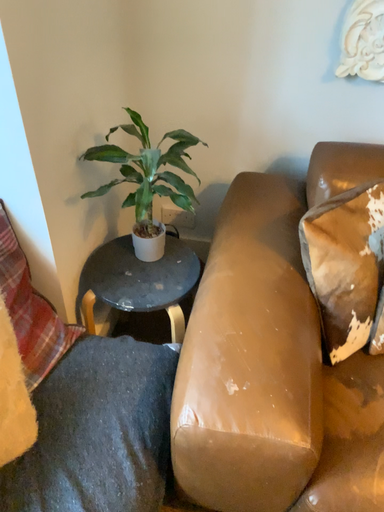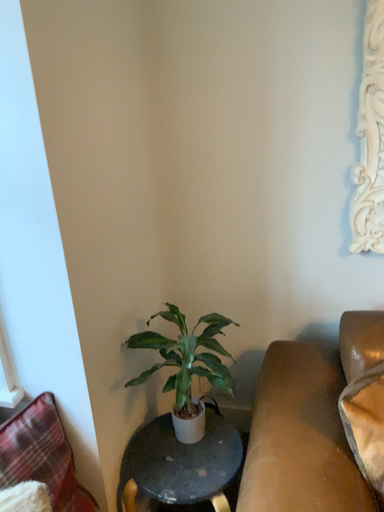
Question: How did the camera likely rotate when shooting the video?

Choices:
 (A) rotated downward
 (B) rotated upward

Answer: (B)